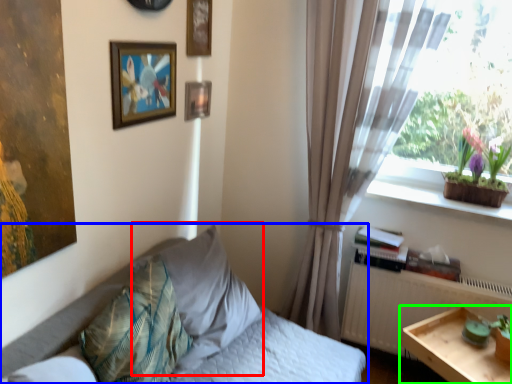
Question: Which is farther away from pillow (highlighted by a red box)? bed (highlighted by a blue box) or table (highlighted by a green box)?

Choices:
 (A) bed
 (B) table

Answer: (B)